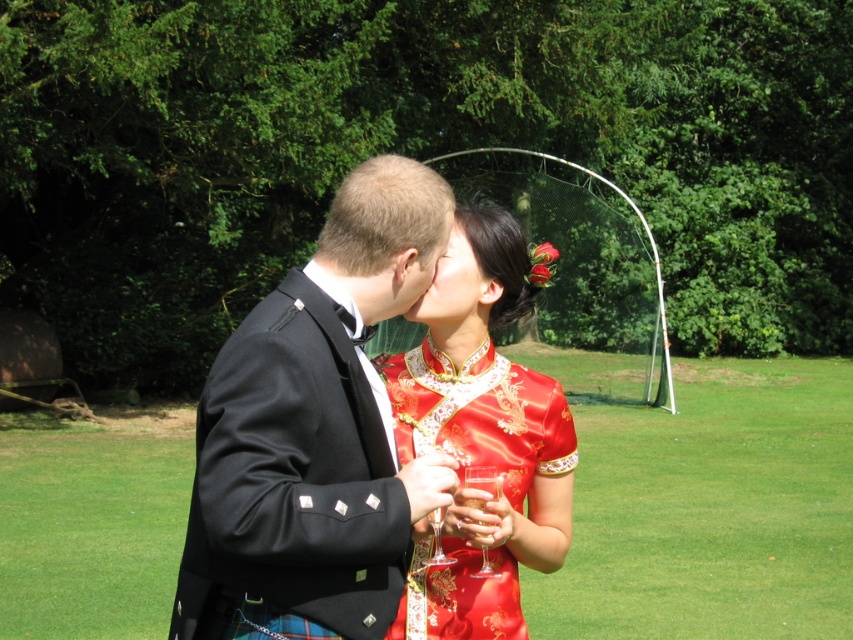
Question: Can you confirm if black satin suit at center is bigger than silky red dress at center?

Choices:
 (A) yes
 (B) no

Answer: (B)

Question: Can you confirm if black satin suit at center is positioned below silky red dress at center?

Choices:
 (A) yes
 (B) no

Answer: (B)

Question: Among these points, which one is nearest to the camera?

Choices:
 (A) click(x=486, y=586)
 (B) click(x=262, y=420)

Answer: (B)

Question: Which point appears farthest from the camera in this image?

Choices:
 (A) (x=247, y=348)
 (B) (x=480, y=502)

Answer: (B)

Question: Is black satin suit at center further to the viewer compared to silky red dress at center?

Choices:
 (A) no
 (B) yes

Answer: (A)